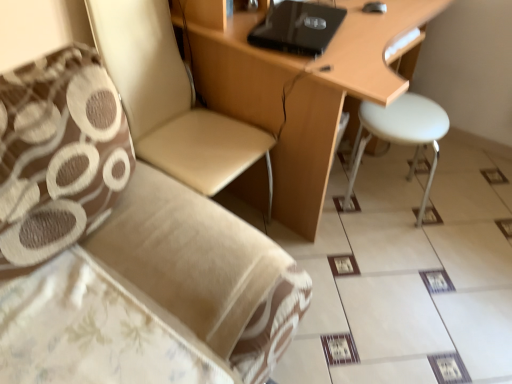
At what (x,y) coordinates should I click in order to perform the action: click on vacant space that's between white plastic stool at right and light brown wood desk at center. Please return your answer as a coordinate pair (x, y). This screenshot has height=384, width=512. Looking at the image, I should click on (409, 212).